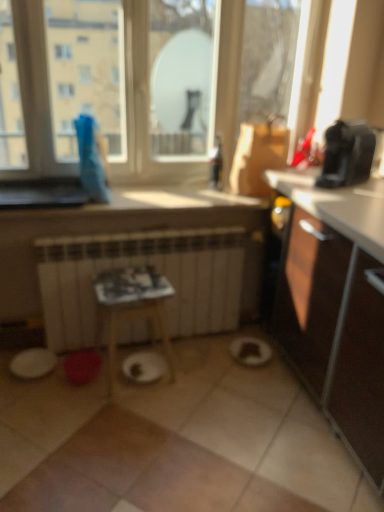
The image size is (384, 512). In order to click on spots to the right of white matte radiator at center in this screenshot , I will do `click(246, 375)`.